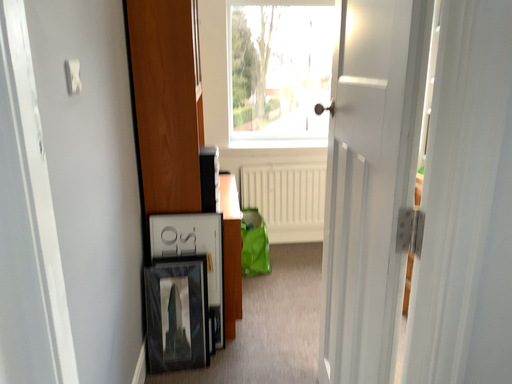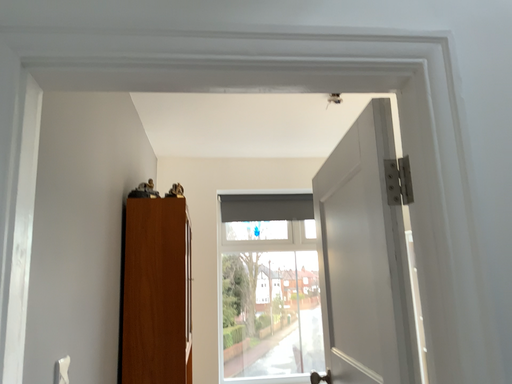
Question: How did the camera likely rotate when shooting the video?

Choices:
 (A) rotated upward
 (B) rotated downward

Answer: (A)